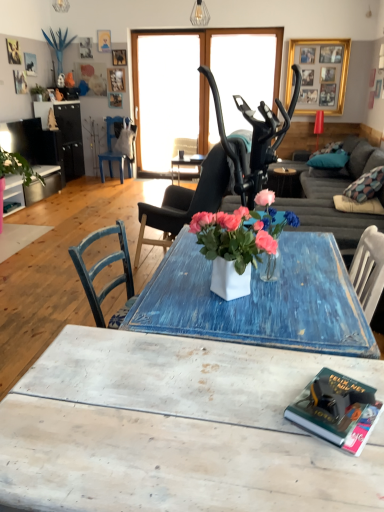
Question: Can you confirm if white distressed wood coffee table at lower center is wider than blue fabric pillow at right?

Choices:
 (A) yes
 (B) no

Answer: (A)

Question: Are white distressed wood coffee table at lower center and blue fabric pillow at right far apart?

Choices:
 (A) no
 (B) yes

Answer: (B)

Question: From the image's perspective, is white distressed wood coffee table at lower center on top of blue fabric pillow at right?

Choices:
 (A) no
 (B) yes

Answer: (A)

Question: From the image's perspective, is white distressed wood coffee table at lower center located beneath blue fabric pillow at right?

Choices:
 (A) yes
 (B) no

Answer: (A)

Question: Does white distressed wood coffee table at lower center have a lesser height compared to blue fabric pillow at right?

Choices:
 (A) yes
 (B) no

Answer: (B)

Question: Does white distressed wood coffee table at lower center appear on the right side of blue fabric pillow at right?

Choices:
 (A) no
 (B) yes

Answer: (A)

Question: From a real-world perspective, is blue distressed table at center physically below blue painted wood chair at left, which ranks as the 1th chair in back-to-front order?

Choices:
 (A) no
 (B) yes

Answer: (B)

Question: Can you confirm if blue distressed table at center is wider than blue painted wood chair at left, placed as the second chair when sorted from bottom to top?

Choices:
 (A) no
 (B) yes

Answer: (A)

Question: Does blue distressed table at center have a lesser height compared to blue painted wood chair at left, which ranks as the 1th chair in back-to-front order?

Choices:
 (A) yes
 (B) no

Answer: (A)

Question: Can you confirm if blue distressed table at center is positioned to the left of blue painted wood chair at left, which ranks as the 1th chair in back-to-front order?

Choices:
 (A) yes
 (B) no

Answer: (B)

Question: Are blue distressed table at center and blue painted wood chair at left, the 1th chair viewed from the top, beside each other?

Choices:
 (A) yes
 (B) no

Answer: (B)

Question: Is blue distressed table at center aimed at blue painted wood chair at left, the second chair in the front-to-back sequence?

Choices:
 (A) no
 (B) yes

Answer: (A)

Question: Can you confirm if blue fabric pillow at right is taller than matte black chair at center, the 2th chair viewed from the top?

Choices:
 (A) no
 (B) yes

Answer: (A)